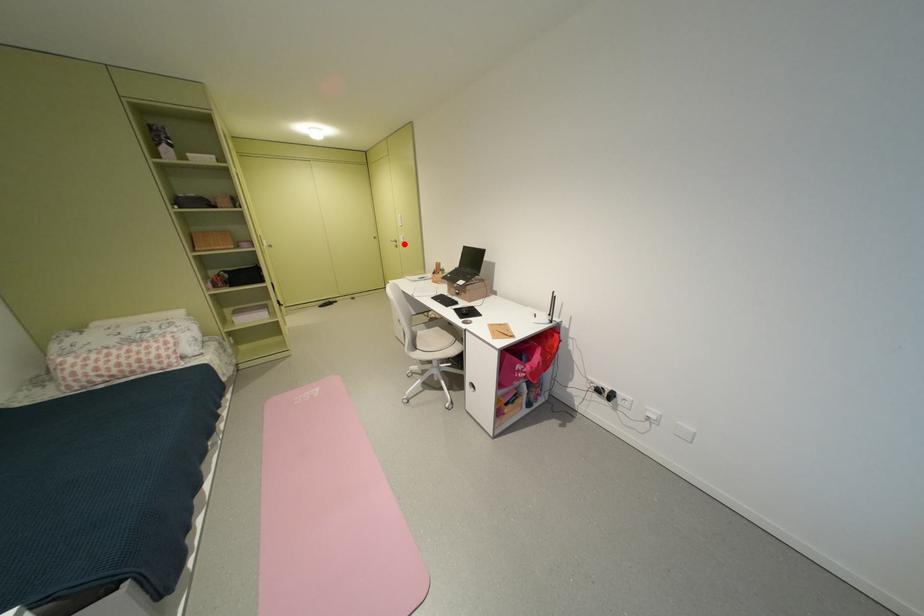
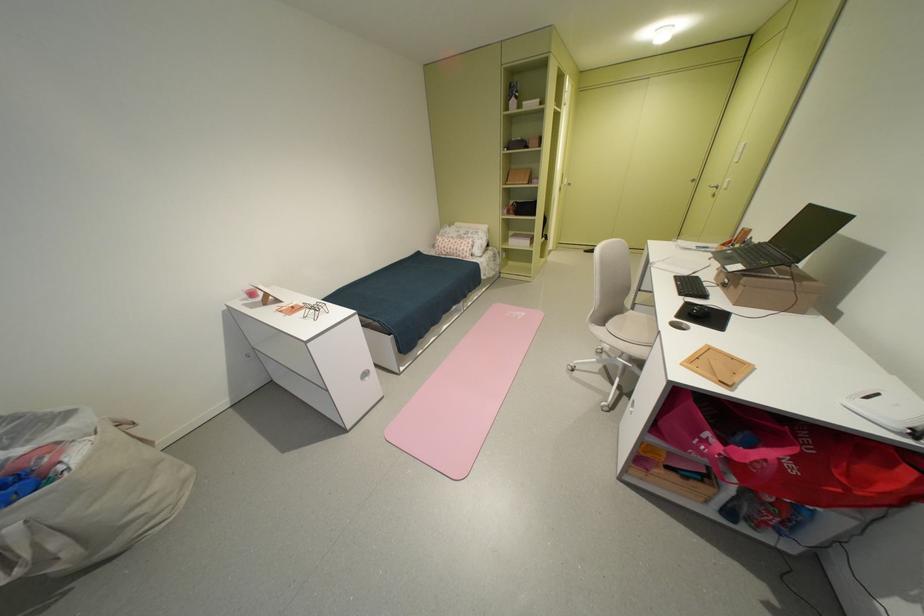
Question: I am providing you with two images of the same scene from different viewpoints. In image1, a red point is highlighted. Considering the same 3D point in image2, which of the following is correct?

Choices:
 (A) It is closer
 (B) It is farther

Answer: (B)